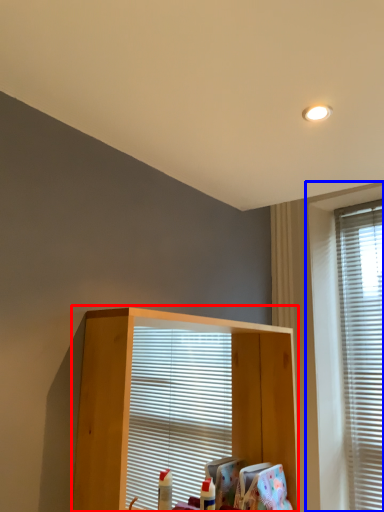
Question: Which object appears closest to the camera in this image, shelf (highlighted by a red box) or window (highlighted by a blue box)?

Choices:
 (A) shelf
 (B) window

Answer: (A)